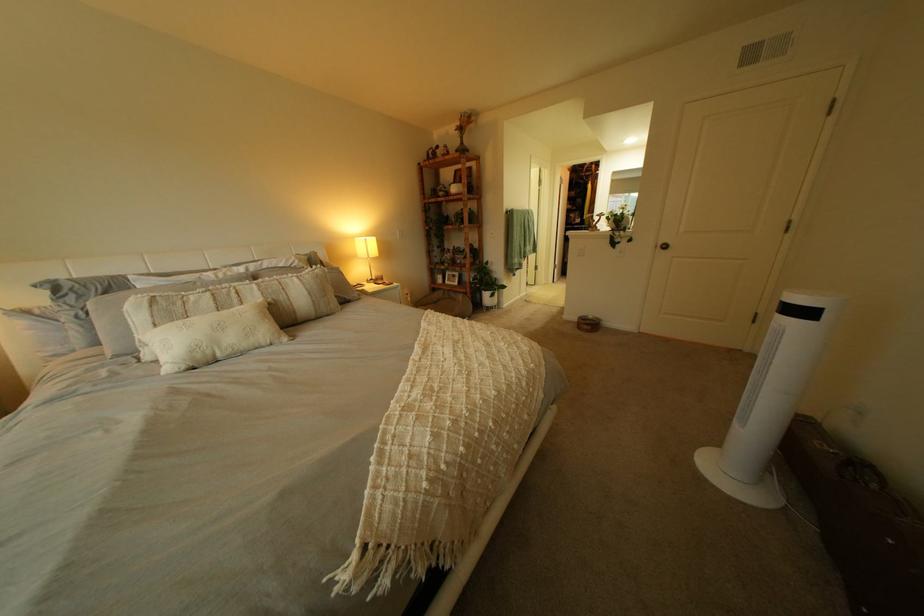
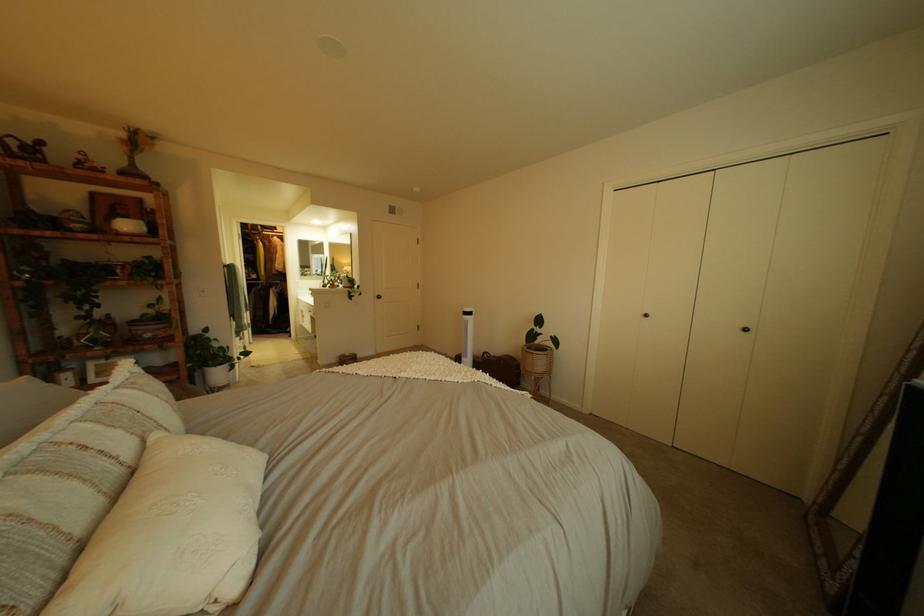
Where in the second image is the point corresponding to the point at 473,124 from the first image?

(139, 137)